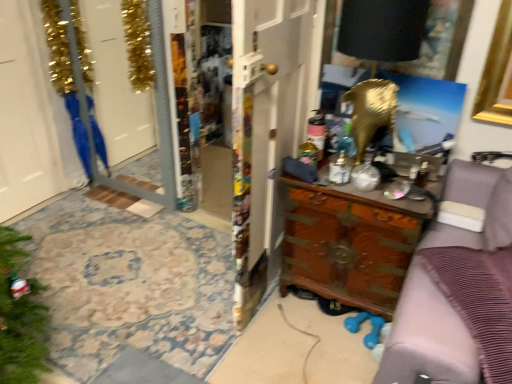
You are a GUI agent. You are given a task and a screenshot of the screen. Output one action in this format:
    pyautogui.click(x=<x>, y=<y>)
    Task: Click on the vacant space in front of wooden door at center, which is counted as the 2th door, starting from the left
    The image size is (512, 384).
    Given the screenshot: What is the action you would take?
    pyautogui.click(x=288, y=342)